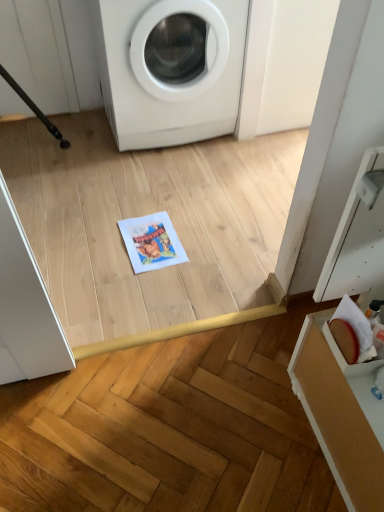
You are a GUI agent. You are given a task and a screenshot of the screen. Output one action in this format:
    pyautogui.click(x=<x>, y=<y>)
    Task: Click on the printed paper at center
    The image size is (384, 512).
    Given the screenshot: What is the action you would take?
    pyautogui.click(x=151, y=242)

Describe the element at coordinates (151, 242) in the screenshot. I see `printed paper at center` at that location.

Looking at this image, what is the approximate width of white glossy washing machine at upper center?

white glossy washing machine at upper center is 20.28 inches wide.

Locate an element on the screen. The height and width of the screenshot is (512, 384). white glossy washing machine at upper center is located at coordinates (170, 68).

Describe the element at coordinates (170, 68) in the screenshot. This screenshot has width=384, height=512. I see `white glossy washing machine at upper center` at that location.

The width and height of the screenshot is (384, 512). I want to click on printed paper at center, so click(151, 242).

In the scene shown: In the image, is white glossy washing machine at upper center on the left side or the right side of printed paper at center?

In the image, white glossy washing machine at upper center appears on the right side of printed paper at center.

Considering the relative positions of white glossy washing machine at upper center and printed paper at center in the image provided, is white glossy washing machine at upper center behind printed paper at center?

No, white glossy washing machine at upper center is closer to the viewer.

Is point (227, 45) farther from viewer compared to point (125, 220)?

Yes, point (227, 45) is behind point (125, 220).

From the image's perspective, which one is positioned higher, white glossy washing machine at upper center or printed paper at center?

white glossy washing machine at upper center, from the image's perspective.

From a real-world perspective, is white glossy washing machine at upper center positioned above or below printed paper at center?

Answer: white glossy washing machine at upper center is above printed paper at center.

Considering the sizes of white glossy washing machine at upper center and printed paper at center in the image, is white glossy washing machine at upper center wider or thinner than printed paper at center?

In the image, white glossy washing machine at upper center appears to be wider than printed paper at center.

Does white glossy washing machine at upper center have a greater height compared to printed paper at center?

Yes, white glossy washing machine at upper center is taller than printed paper at center.

Considering the relative sizes of white glossy washing machine at upper center and printed paper at center in the image provided, is white glossy washing machine at upper center smaller than printed paper at center?

Incorrect, white glossy washing machine at upper center is not smaller in size than printed paper at center.

Is white glossy washing machine at upper center spatially inside printed paper at center, or outside of it?

white glossy washing machine at upper center cannot be found inside printed paper at center.

Is white glossy washing machine at upper center far away from printed paper at center?

No.

Is white glossy washing machine at upper center aimed at printed paper at center?

Yes, white glossy washing machine at upper center is oriented towards printed paper at center.

From the picture: What's the angular difference between white glossy washing machine at upper center and printed paper at center's facing directions?

The facing directions of white glossy washing machine at upper center and printed paper at center are 2.7 degrees apart.

Find the location of a particular element. This screenshot has height=512, width=384. washing machine above the printed paper at center (from the image's perspective) is located at coordinates (170, 68).

Is printed paper at center to the left or to the right of white glossy washing machine at upper center in the image?

Based on their positions, printed paper at center is located to the left of white glossy washing machine at upper center.

Is printed paper at center in front of or behind white glossy washing machine at upper center in the image?

In the image, printed paper at center appears behind white glossy washing machine at upper center.

Considering the points (161, 250) and (200, 24), which point is in front, point (161, 250) or point (200, 24)?

The point (161, 250) is closer.

From the image's perspective, between printed paper at center and white glossy washing machine at upper center, which one is located above?

white glossy washing machine at upper center.

From a real-world perspective, which object stands above the other?

From a 3D spatial view, white glossy washing machine at upper center is above.

Is printed paper at center wider than white glossy washing machine at upper center?

Incorrect, the width of printed paper at center does not surpass that of white glossy washing machine at upper center.

Between printed paper at center and white glossy washing machine at upper center, which one has less height?

printed paper at center.

Is printed paper at center smaller than white glossy washing machine at upper center?

Correct, printed paper at center occupies less space than white glossy washing machine at upper center.

Is printed paper at center inside or outside of white glossy washing machine at upper center?

printed paper at center exists outside the volume of white glossy washing machine at upper center.

Can you see printed paper at center touching white glossy washing machine at upper center?

They are not placed beside each other.

Looking at this image, is printed paper at center oriented towards white glossy washing machine at upper center?

No, printed paper at center is not oriented towards white glossy washing machine at upper center.

Can you tell me how much printed paper at center and white glossy washing machine at upper center differ in facing direction?

printed paper at center and white glossy washing machine at upper center are facing 2.7 degrees away from each other.

Identify the location of copy lying on the left of white glossy washing machine at upper center. The width and height of the screenshot is (384, 512). (151, 242).

You are a GUI agent. You are given a task and a screenshot of the screen. Output one action in this format:
    pyautogui.click(x=<x>, y=<y>)
    Task: Click on the copy located behind the white glossy washing machine at upper center
    
    Given the screenshot: What is the action you would take?
    pyautogui.click(x=151, y=242)

Find the location of `copy below the white glossy washing machine at upper center (from the image's perspective)`. copy below the white glossy washing machine at upper center (from the image's perspective) is located at coordinates (151, 242).